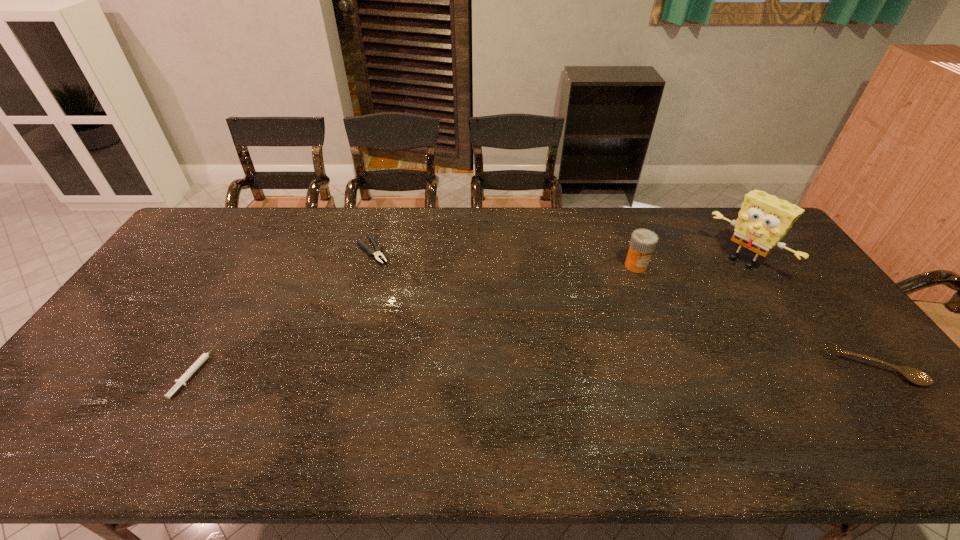
This screenshot has height=540, width=960. I want to click on syringe, so tap(182, 380).

Identify the location of the third tallest object. The width and height of the screenshot is (960, 540). (913, 375).

Find the location of `sponge`. sponge is located at coordinates (764, 219).

Find the location of a particular element. The width and height of the screenshot is (960, 540). medicine is located at coordinates click(x=643, y=242).

Image resolution: width=960 pixels, height=540 pixels. Identify the location of the third object from left to right. (643, 242).

You are a GUI agent. You are given a task and a screenshot of the screen. Output one action in this format:
    pyautogui.click(x=<x>, y=<y>)
    Task: Click on the second object from left to right
    Image resolution: width=960 pixels, height=540 pixels.
    Given the screenshot: What is the action you would take?
    pyautogui.click(x=378, y=249)

Identify the location of free space located on the back of the syringe. The height and width of the screenshot is (540, 960). (248, 276).

Identify the location of vacant region located on the left of the third tallest object. (783, 368).

Locate an element on the screen. This screenshot has height=540, width=960. free region located on the face of the tallest object is located at coordinates (709, 293).

Where is `vacant area situated 0.330m on the face of the tallest object`? The height and width of the screenshot is (540, 960). vacant area situated 0.330m on the face of the tallest object is located at coordinates 669,327.